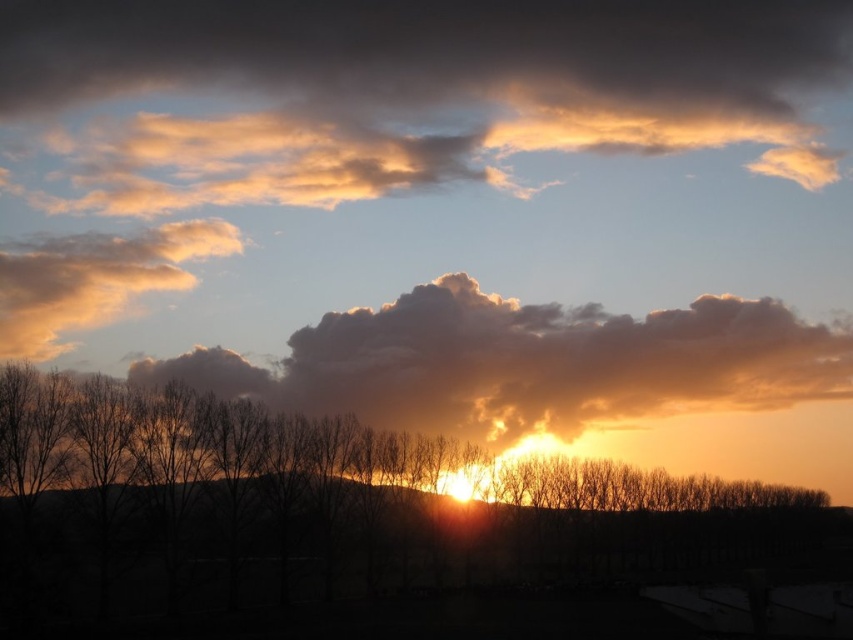
You are an artist painting the sunset scene. You want to ensure the cloudy sky at center and the golden fluffy cloud at upper left are proportionally accurate. Which object should you paint wider?

The cloudy sky at center should be painted wider since its width surpasses that of the golden fluffy cloud at upper left.

You are an astronomer observing the sunset scene. You notice the cloudy sky at center and the golden fluffy cloud at upper left. Which cloud is closer to your observation point?

The golden fluffy cloud at upper left is closer to the observation point than the cloudy sky at center because it is positioned at a shorter distance from the observer.